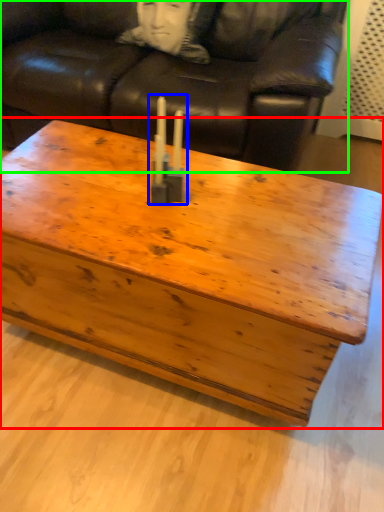
Question: Based on their relative distances, which object is farther from coffee table (highlighted by a red box)? Choose from candle holder (highlighted by a blue box) and studio couch (highlighted by a green box).

Choices:
 (A) candle holder
 (B) studio couch

Answer: (B)